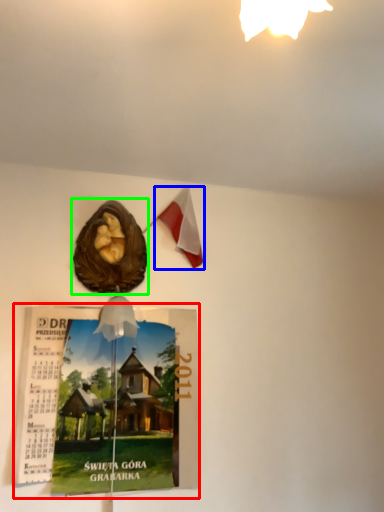
Question: Based on their relative distances, which object is farther from magazine (highlighted by a red box)? Choose from flag (highlighted by a blue box) and flyer (highlighted by a green box).

Choices:
 (A) flag
 (B) flyer

Answer: (A)